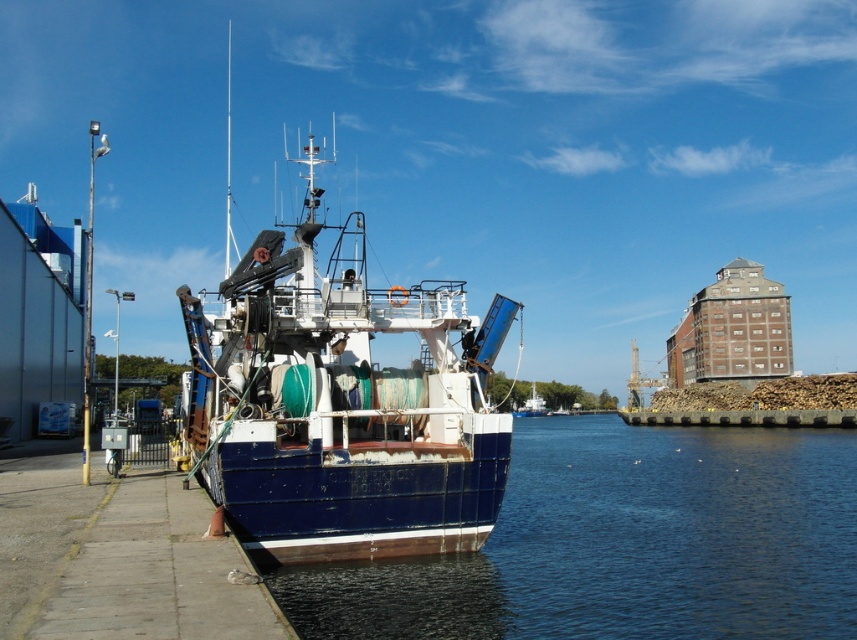
Does blue water at lower left appear on the right side of blue painted wooden boat at center?

No, blue water at lower left is not to the right of blue painted wooden boat at center.

Describe the element at coordinates (624, 545) in the screenshot. This screenshot has width=857, height=640. I see `blue water at lower left` at that location.

Locate an element on the screen. Image resolution: width=857 pixels, height=640 pixels. blue water at lower left is located at coordinates (624, 545).